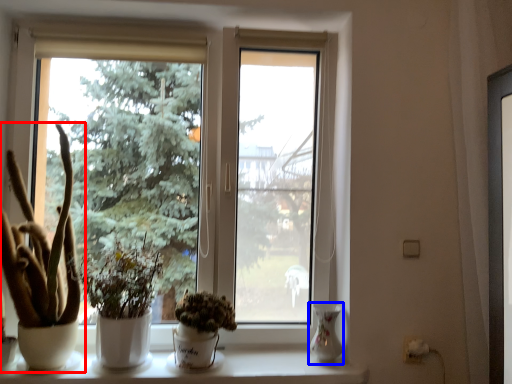
Question: Which point is further to the camera, houseplant (highlighted by a red box) or glass vase (highlighted by a blue box)?

Choices:
 (A) houseplant
 (B) glass vase

Answer: (B)